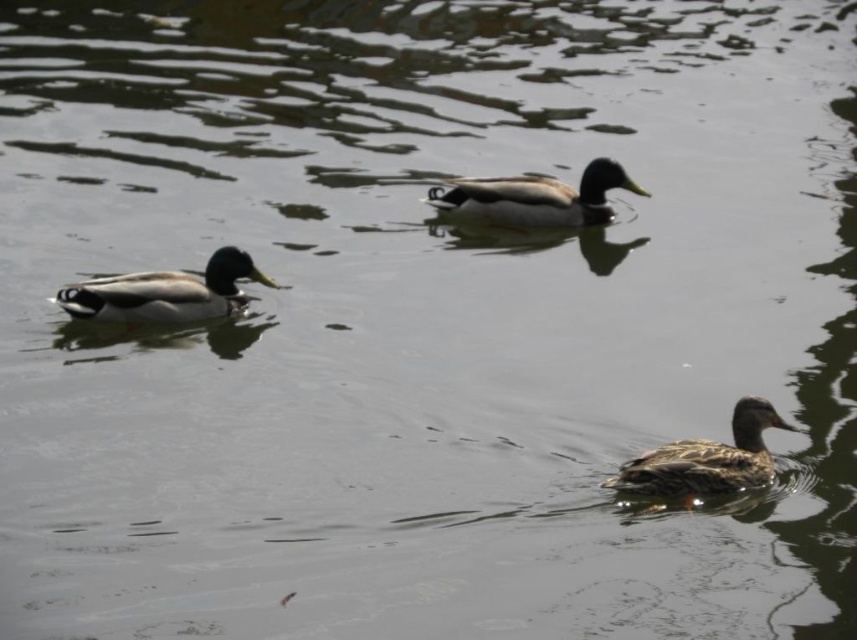
You are standing on the dock and see the point marked at coordinates (706, 460). Which object is this point located on?

The point marked at coordinates (706, 460) is located on the brown speckled duck at lower right.

You are observing the ducks in the serene scene. There are two points marked on the image, point (x=718, y=454) and point (x=594, y=209). Which of these points is closer to you?

Point (x=718, y=454) is closer to the camera than point (x=594, y=209).